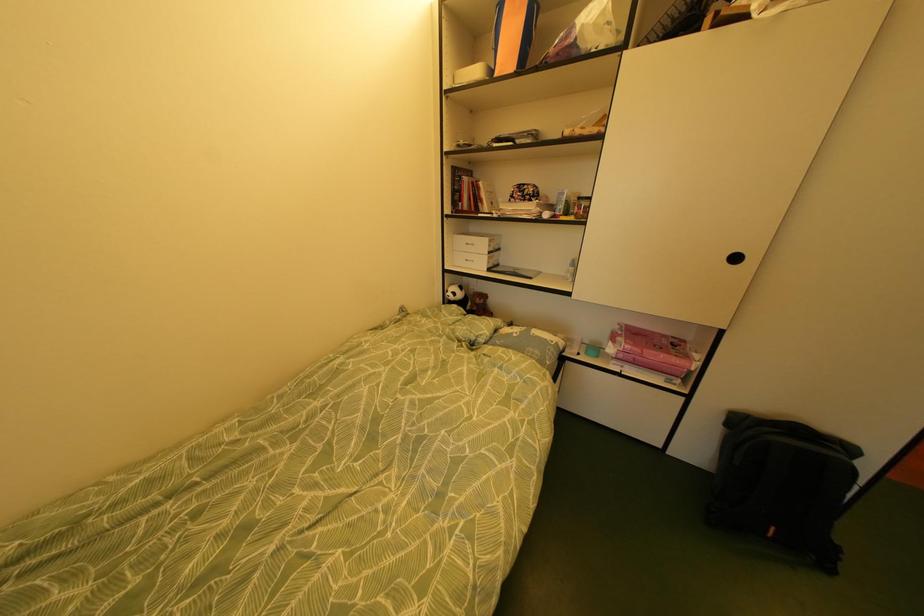
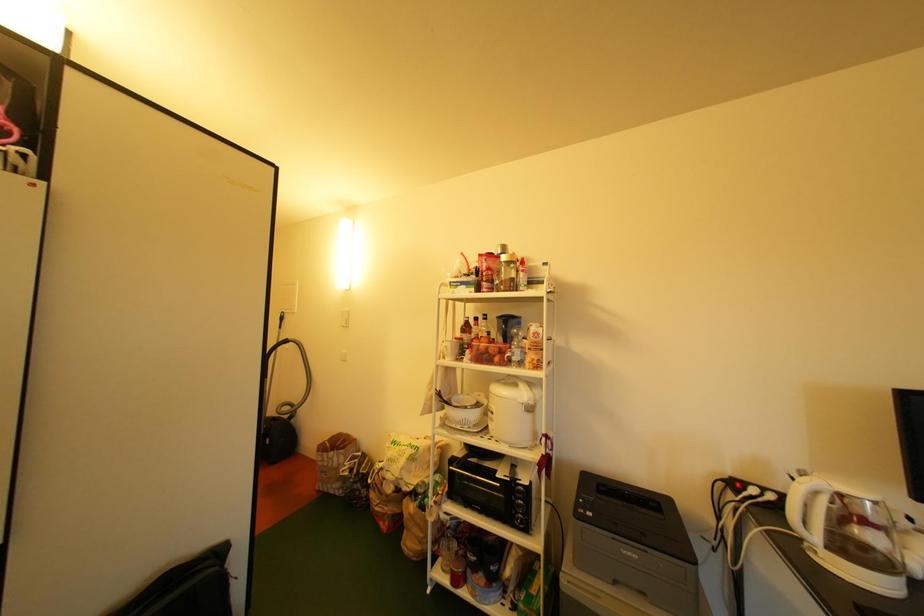
Question: Based on the continuous images, in which direction is the camera rotating? Reply with the corresponding letter.

Choices:
 (A) Left
 (B) Right
 (C) Up
 (D) Down

Answer: (B)